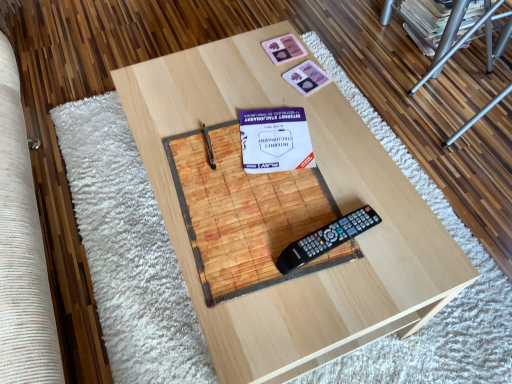
Where is `empty space that is ontop of wooden table at center (from a real-world perspective)`? This screenshot has height=384, width=512. empty space that is ontop of wooden table at center (from a real-world perspective) is located at coordinates (270, 166).